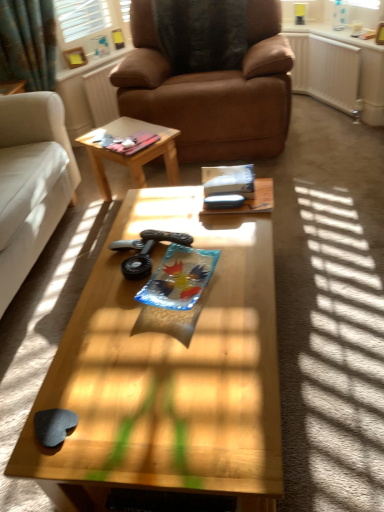
At what (x,y) coordinates should I click in order to perform the action: click on blank space to the left of wooden at center, the first coffee table positioned from the top. Please return your answer as a coordinate pair (x, y). Image resolution: width=384 pixels, height=512 pixels. Looking at the image, I should click on (92, 199).